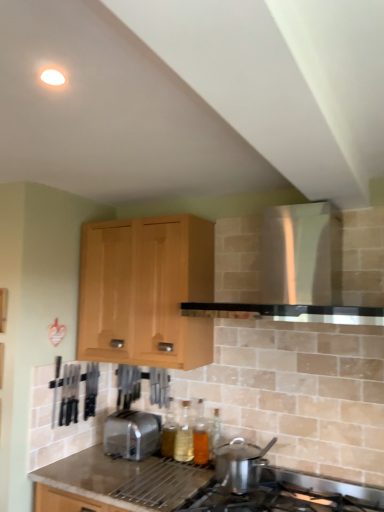
Question: Does granite gray countertop at lower center appear on the left side of translucent glass bottle at lower center, positioned as the second bottle in right-to-left order?

Choices:
 (A) yes
 (B) no

Answer: (A)

Question: Is granite gray countertop at lower center thinner than translucent glass bottle at lower center, marked as the second bottle in a left-to-right arrangement?

Choices:
 (A) yes
 (B) no

Answer: (B)

Question: Considering the relative sizes of granite gray countertop at lower center and translucent glass bottle at lower center, positioned as the second bottle in right-to-left order, in the image provided, is granite gray countertop at lower center smaller than translucent glass bottle at lower center, positioned as the second bottle in right-to-left order,?

Choices:
 (A) no
 (B) yes

Answer: (A)

Question: Does granite gray countertop at lower center have a greater height compared to translucent glass bottle at lower center, positioned as the second bottle in right-to-left order?

Choices:
 (A) no
 (B) yes

Answer: (B)

Question: From the image's perspective, is granite gray countertop at lower center located above translucent glass bottle at lower center, positioned as the second bottle in right-to-left order?

Choices:
 (A) yes
 (B) no

Answer: (B)

Question: Is granite gray countertop at lower center far away from translucent glass bottle at lower center, positioned as the second bottle in right-to-left order?

Choices:
 (A) yes
 (B) no

Answer: (B)

Question: From the image's perspective, is white glossy vent at upper center over stainless steel pot at lower center?

Choices:
 (A) yes
 (B) no

Answer: (A)

Question: Can you confirm if white glossy vent at upper center is taller than stainless steel pot at lower center?

Choices:
 (A) no
 (B) yes

Answer: (B)

Question: Does white glossy vent at upper center have a smaller size compared to stainless steel pot at lower center?

Choices:
 (A) yes
 (B) no

Answer: (B)

Question: From a real-world perspective, is white glossy vent at upper center located higher than stainless steel pot at lower center?

Choices:
 (A) yes
 (B) no

Answer: (A)

Question: Is white glossy vent at upper center located outside stainless steel pot at lower center?

Choices:
 (A) no
 (B) yes

Answer: (B)

Question: Considering the relative sizes of white glossy vent at upper center and stainless steel pot at lower center in the image provided, is white glossy vent at upper center bigger than stainless steel pot at lower center?

Choices:
 (A) yes
 (B) no

Answer: (A)

Question: Is translucent glass bottle at center, the first bottle in the right-to-left sequence, bigger than satin silver toaster at lower center?

Choices:
 (A) yes
 (B) no

Answer: (B)